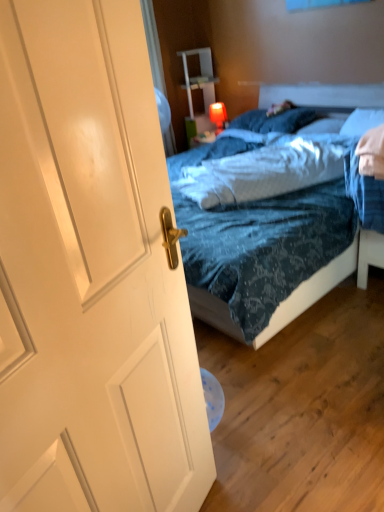
Question: Which direction should I rotate to face blue textured pillow at center, which ranks as the third pillow in right-to-left order, — up or down?

Choices:
 (A) up
 (B) down

Answer: (A)

Question: Is blue textured pillow at center, the 1th pillow in the left-to-right sequence, in contact with white matte door at left?

Choices:
 (A) no
 (B) yes

Answer: (A)

Question: Is blue textured pillow at center, which ranks as the third pillow in right-to-left order, bigger than white matte door at left?

Choices:
 (A) no
 (B) yes

Answer: (A)

Question: Is blue textured pillow at center, which ranks as the third pillow in right-to-left order, to the left of white matte door at left from the viewer's perspective?

Choices:
 (A) no
 (B) yes

Answer: (A)

Question: Is blue textured pillow at center, which ranks as the third pillow in right-to-left order, to the right of white matte door at left from the viewer's perspective?

Choices:
 (A) yes
 (B) no

Answer: (A)

Question: From the image's perspective, is blue textured pillow at center, the 1th pillow in the left-to-right sequence, on white matte door at left?

Choices:
 (A) yes
 (B) no

Answer: (A)

Question: Considering the relative positions of blue textured pillow at center, which ranks as the third pillow in right-to-left order, and white matte door at left in the image provided, is blue textured pillow at center, which ranks as the third pillow in right-to-left order, behind white matte door at left?

Choices:
 (A) yes
 (B) no

Answer: (A)

Question: From a real-world perspective, is white soft pillow at upper right, which is counted as the 3th pillow, starting from the left, below blue textured bedsheet at center?

Choices:
 (A) no
 (B) yes

Answer: (A)

Question: Is white soft pillow at upper right, acting as the 1th pillow starting from the right, thinner than blue textured bedsheet at center?

Choices:
 (A) no
 (B) yes

Answer: (B)

Question: Does white soft pillow at upper right, acting as the 1th pillow starting from the right, have a greater height compared to blue textured bedsheet at center?

Choices:
 (A) no
 (B) yes

Answer: (B)

Question: Are white soft pillow at upper right, which is counted as the 3th pillow, starting from the left, and blue textured bedsheet at center beside each other?

Choices:
 (A) no
 (B) yes

Answer: (A)

Question: Can you confirm if white soft pillow at upper right, which is counted as the 3th pillow, starting from the left, is shorter than blue textured bedsheet at center?

Choices:
 (A) yes
 (B) no

Answer: (B)

Question: Can you confirm if white soft pillow at upper right, acting as the 1th pillow starting from the right, is positioned to the right of blue textured bedsheet at center?

Choices:
 (A) no
 (B) yes

Answer: (B)

Question: Does white soft pillow at upper center, which appears as the 2th pillow when viewed from the right, have a lesser height compared to blue textured bedsheet at center?

Choices:
 (A) yes
 (B) no

Answer: (A)